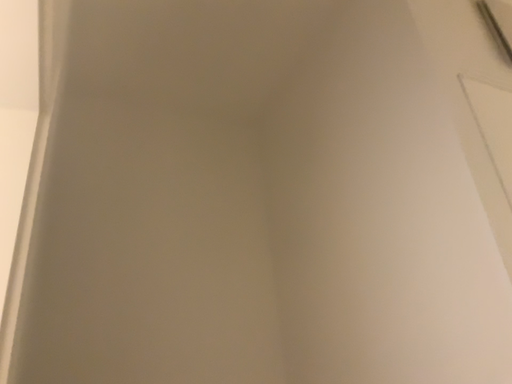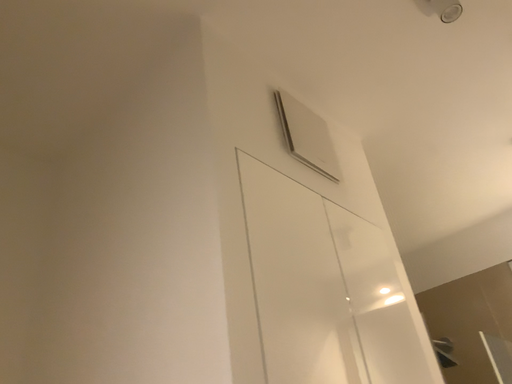
Question: How did the camera likely rotate when shooting the video?

Choices:
 (A) rotated downward
 (B) rotated upward

Answer: (B)